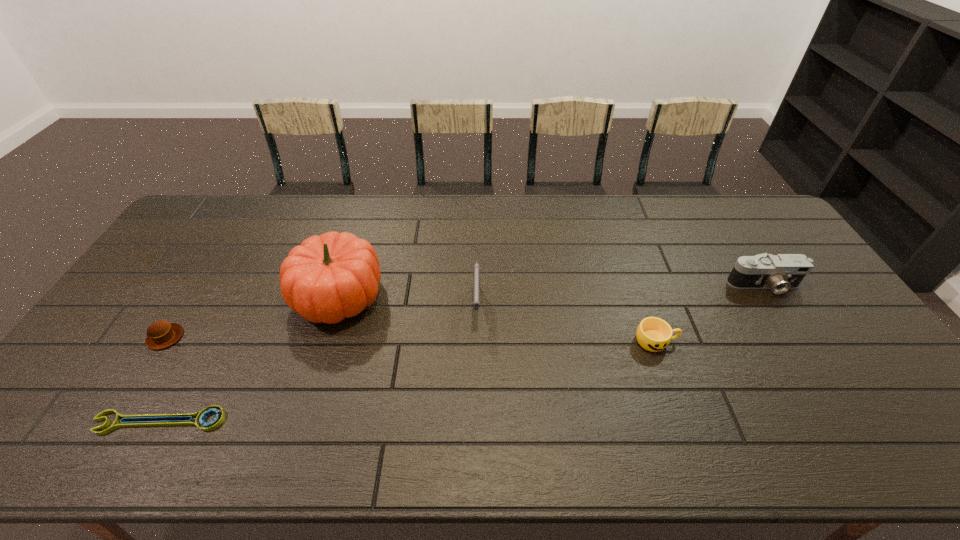
Image resolution: width=960 pixels, height=540 pixels. I want to click on empty space that is in between the fifth object from left to right and the muffin, so click(x=411, y=339).

Locate an element on the screen. free space between the second object from right to left and the tallest object is located at coordinates (497, 319).

Find the location of a particular element. This screenshot has height=540, width=960. vacant area that lies between the tallest object and the rightmost object is located at coordinates (551, 291).

Identify the location of the closest object relative to the muffin. The height and width of the screenshot is (540, 960). (200, 416).

Locate which object ranks third in proximity to the rightmost object. Please provide its 2D coordinates. Your answer should be formatted as a tuple, i.e. [(x, y)], where the tuple contains the x and y coordinates of a point satisfying the conditions above.

[(328, 278)]

The image size is (960, 540). Find the location of `vacant area in the image that satisfies the following two spatial constraints: 1. on the back side of the muffin; 2. on the right side of the pumpkin`. vacant area in the image that satisfies the following two spatial constraints: 1. on the back side of the muffin; 2. on the right side of the pumpkin is located at coordinates (191, 296).

Locate an element on the screen. The image size is (960, 540). vacant area in the image that satisfies the following two spatial constraints: 1. on the back side of the wrench; 2. on the right side of the tallest object is located at coordinates (228, 296).

Find the location of a particular element. This screenshot has width=960, height=540. free space that satisfies the following two spatial constraints: 1. at the barrel of the fourth object from left to right; 2. on the left side of the fifth object from left to right is located at coordinates (476, 341).